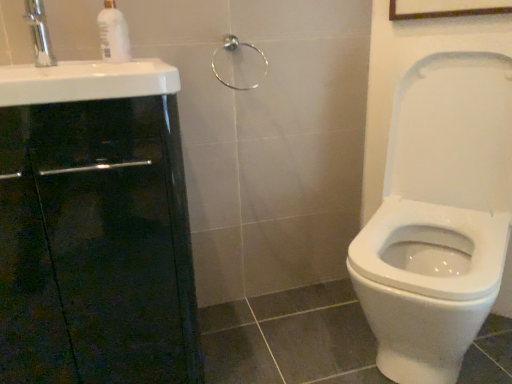
This screenshot has height=384, width=512. What are the coordinates of `silver metallic faucet at upper left` in the screenshot? It's located at (39, 33).

The width and height of the screenshot is (512, 384). What do you see at coordinates (86, 81) in the screenshot?
I see `white glossy sink at left` at bounding box center [86, 81].

What are the coordinates of `satin nickel towel ring at upper center` in the screenshot? It's located at (x=233, y=50).

Between black glossy cabinet at left and satin nickel towel ring at upper center, which one has less height?

With less height is satin nickel towel ring at upper center.

How far apart are black glossy cabinet at left and satin nickel towel ring at upper center?

black glossy cabinet at left and satin nickel towel ring at upper center are 26.46 inches apart.

How different are the orientations of black glossy cabinet at left and satin nickel towel ring at upper center in degrees?

The facing directions of black glossy cabinet at left and satin nickel towel ring at upper center are 0.0377 degrees apart.

The width and height of the screenshot is (512, 384). I want to click on screen door located on the left of satin nickel towel ring at upper center, so click(96, 245).

Is white glossy sink at left thinner than white glossy soap dispenser at upper left?

No, white glossy sink at left is not thinner than white glossy soap dispenser at upper left.

Is white glossy sink at left to the left of white glossy soap dispenser at upper left from the viewer's perspective?

Yes.

Between point (55, 78) and point (115, 23), which one is positioned behind?

Point (115, 23)

From the image's perspective, which is below, white glossy sink at left or white glossy soap dispenser at upper left?

white glossy sink at left appears lower in the image.

Visually, is black glossy cabinet at left positioned to the left or to the right of white glossy soap dispenser at upper left?

black glossy cabinet at left is to the left of white glossy soap dispenser at upper left.

From the image's perspective, between black glossy cabinet at left and white glossy soap dispenser at upper left, who is located below?

From the image's view, black glossy cabinet at left is below.

From a real-world perspective, is black glossy cabinet at left under white glossy soap dispenser at upper left?

Correct, in the physical world, black glossy cabinet at left is lower than white glossy soap dispenser at upper left.

Is the surface of black glossy cabinet at left in direct contact with white glossy soap dispenser at upper left?

No, black glossy cabinet at left is not beside white glossy soap dispenser at upper left.

From the image's perspective, is white glossy sink at left below black glossy cabinet at left?

Actually, white glossy sink at left appears above black glossy cabinet at left in the image.

Is the position of white glossy sink at left more distant than that of black glossy cabinet at left?

Yes, white glossy sink at left is further from the viewer.

Between point (4, 81) and point (166, 280), which one is positioned behind?

The point (166, 280) is behind.

Considering the positions of objects white glossy soap dispenser at upper left and black glossy cabinet at left in the image provided, who is more to the left, white glossy soap dispenser at upper left or black glossy cabinet at left?

black glossy cabinet at left.

From the picture: From the image's perspective, is white glossy soap dispenser at upper left located above or below black glossy cabinet at left?

Clearly, from the image's perspective, white glossy soap dispenser at upper left is above black glossy cabinet at left.

Considering the points (105, 44) and (24, 143), which point is in front, point (105, 44) or point (24, 143)?

The point (24, 143) is in front.

Between white glossy soap dispenser at upper left and black glossy cabinet at left, which one has smaller width?

Thinner between the two is white glossy soap dispenser at upper left.

Which object is positioned more to the left, satin nickel towel ring at upper center or white glossy sink at left?

white glossy sink at left.

Is point (215, 72) positioned before point (163, 75)?

No.

How distant is satin nickel towel ring at upper center from white glossy sink at left?

The distance of satin nickel towel ring at upper center from white glossy sink at left is 16.16 inches.

Is satin nickel towel ring at upper center next to white glossy sink at left and touching it?

No.

In the scene shown: From a real-world perspective, is white glossy soap dispenser at upper left over silver metallic faucet at upper left?

Yes, from a real-world perspective, white glossy soap dispenser at upper left is above silver metallic faucet at upper left.

Which is more to the left, white glossy soap dispenser at upper left or silver metallic faucet at upper left?

Positioned to the left is silver metallic faucet at upper left.

Is white glossy soap dispenser at upper left facing away from silver metallic faucet at upper left?

That's not correct — white glossy soap dispenser at upper left is not looking away from silver metallic faucet at upper left.

Does white glossy soap dispenser at upper left touch silver metallic faucet at upper left?

No, white glossy soap dispenser at upper left is not making contact with silver metallic faucet at upper left.

This screenshot has width=512, height=384. I want to click on shower that appears behind the black glossy cabinet at left, so click(x=233, y=50).

In the image, there is a white glossy soap dispenser at upper left. Where is `counter top below it (from the image's perspective)`? counter top below it (from the image's perspective) is located at coordinates (86, 81).

When comparing their distances from satin nickel towel ring at upper center, does white glossy sink at left or black glossy cabinet at left seem further?

black glossy cabinet at left lies further to satin nickel towel ring at upper center than the other object.

Looking at the image, which one is located further to silver metallic faucet at upper left, black glossy cabinet at left or white glossy soap dispenser at upper left?

black glossy cabinet at left.

When comparing their distances from white glossy soap dispenser at upper left, does white glossy sink at left or satin nickel towel ring at upper center seem closer?

Based on the image, white glossy sink at left appears to be nearer to white glossy soap dispenser at upper left.

Based on their spatial positions, is silver metallic faucet at upper left or satin nickel towel ring at upper center closer to white glossy soap dispenser at upper left?

silver metallic faucet at upper left.

Based on their spatial positions, is white glossy soap dispenser at upper left or silver metallic faucet at upper left closer to white glossy sink at left?

white glossy soap dispenser at upper left lies closer to white glossy sink at left than the other object.

Looking at the image, which one is located further to black glossy cabinet at left, satin nickel towel ring at upper center or white glossy sink at left?

The object further to black glossy cabinet at left is satin nickel towel ring at upper center.

Looking at the image, which one is located further to satin nickel towel ring at upper center, silver metallic faucet at upper left or white glossy sink at left?

The object further to satin nickel towel ring at upper center is silver metallic faucet at upper left.

Looking at the image, which one is located further to white glossy sink at left, black glossy cabinet at left or silver metallic faucet at upper left?

black glossy cabinet at left.

You are a GUI agent. You are given a task and a screenshot of the screen. Output one action in this format:
    pyautogui.click(x=<x>, y=<y>)
    Task: Click on the counter top between black glossy cabinet at left and satin nickel towel ring at upper center in the front-back direction
    Image resolution: width=512 pixels, height=384 pixels.
    Given the screenshot: What is the action you would take?
    click(x=86, y=81)

The height and width of the screenshot is (384, 512). I want to click on soap dispenser located between white glossy sink at left and satin nickel towel ring at upper center in the depth direction, so click(113, 34).

Locate an element on the screen. This screenshot has width=512, height=384. shower between white glossy soap dispenser at upper left and black glossy cabinet at left in the up-down direction is located at coordinates (233, 50).

The height and width of the screenshot is (384, 512). I want to click on counter top that lies between silver metallic faucet at upper left and black glossy cabinet at left from top to bottom, so click(86, 81).